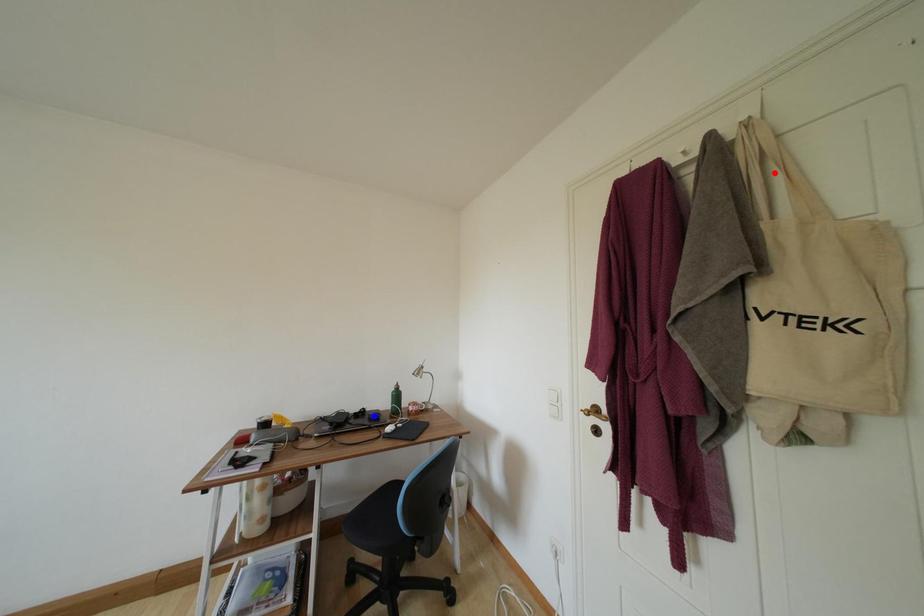
Question: In the image, two points are highlighted. Which point is nearer to the camera? Reply with the corresponding letter.

Choices:
 (A) blue point
 (B) red point

Answer: (B)